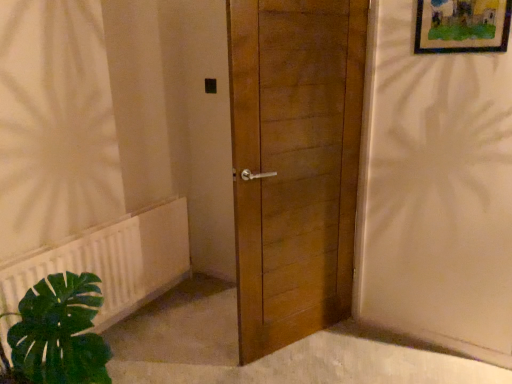
Question: Is wooden door at center thinner than white plastic radiator at lower left?

Choices:
 (A) yes
 (B) no

Answer: (B)

Question: Is wooden door at center positioned in front of white plastic radiator at lower left?

Choices:
 (A) yes
 (B) no

Answer: (A)

Question: Does wooden door at center have a smaller size compared to white plastic radiator at lower left?

Choices:
 (A) yes
 (B) no

Answer: (B)

Question: Does wooden door at center contain white plastic radiator at lower left?

Choices:
 (A) no
 (B) yes

Answer: (A)

Question: Is white plastic radiator at lower left at the back of wooden door at center?

Choices:
 (A) yes
 (B) no

Answer: (B)

Question: In the image, is wooden framed artwork at upper right positioned in front of or behind white plastic radiator at lower left?

Choices:
 (A) front
 (B) behind

Answer: (A)

Question: Is wooden framed artwork at upper right taller or shorter than white plastic radiator at lower left?

Choices:
 (A) tall
 (B) short

Answer: (B)

Question: From a real-world perspective, is wooden framed artwork at upper right positioned above or below white plastic radiator at lower left?

Choices:
 (A) below
 (B) above

Answer: (B)

Question: Is wooden framed artwork at upper right spatially inside white plastic radiator at lower left, or outside of it?

Choices:
 (A) inside
 (B) outside

Answer: (B)

Question: From a real-world perspective, is white plastic radiator at lower left above or below wooden door at center?

Choices:
 (A) below
 (B) above

Answer: (A)

Question: From their relative heights in the image, would you say white plastic radiator at lower left is taller or shorter than wooden door at center?

Choices:
 (A) tall
 (B) short

Answer: (B)

Question: Is white plastic radiator at lower left situated inside wooden door at center or outside?

Choices:
 (A) inside
 (B) outside

Answer: (B)

Question: Based on their sizes in the image, would you say white plastic radiator at lower left is bigger or smaller than wooden door at center?

Choices:
 (A) small
 (B) big

Answer: (A)

Question: In terms of size, does wooden framed artwork at upper right appear bigger or smaller than wooden door at center?

Choices:
 (A) small
 (B) big

Answer: (A)

Question: Considering the positions of wooden framed artwork at upper right and wooden door at center in the image, is wooden framed artwork at upper right wider or thinner than wooden door at center?

Choices:
 (A) wide
 (B) thin

Answer: (B)